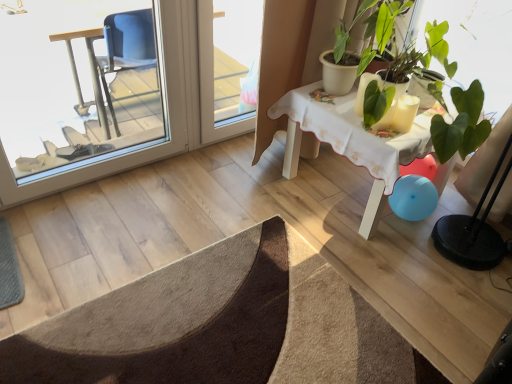
The image size is (512, 384). I want to click on blank area beneath transparent plastic screen door at upper center, which ranks as the 2th screen door in left-to-right order (from a real-world perspective), so click(228, 136).